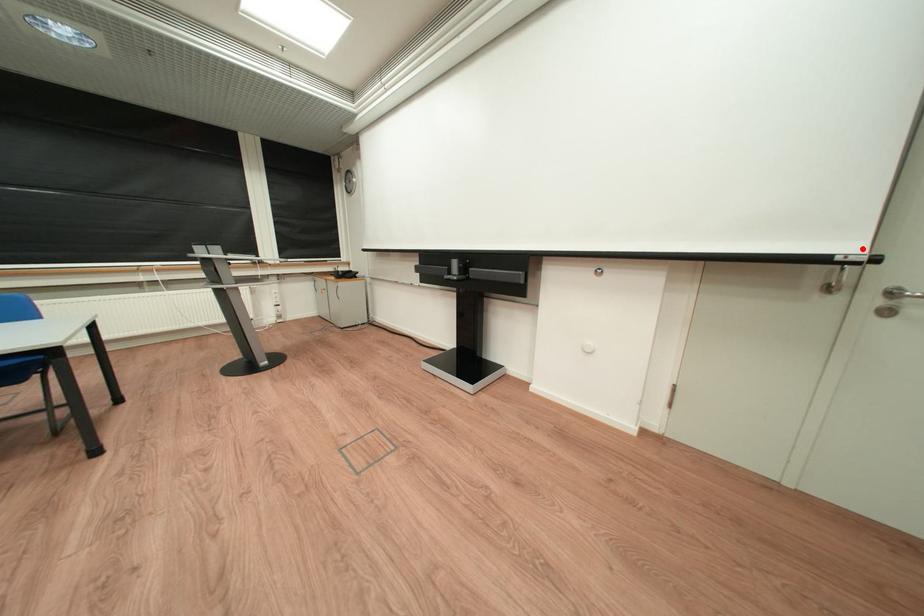
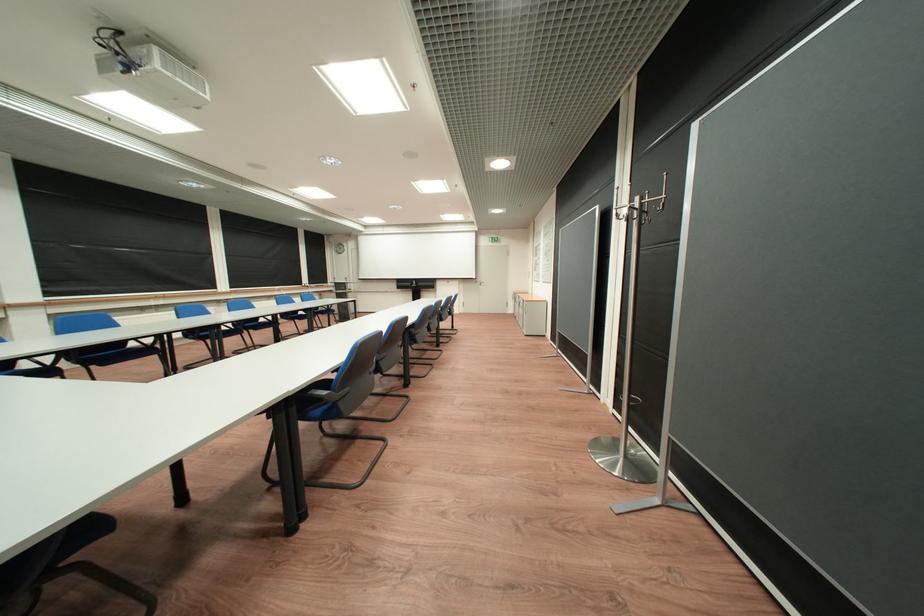
Where in the second image is the point corresponding to the highlighted location from the first image?

(487, 278)